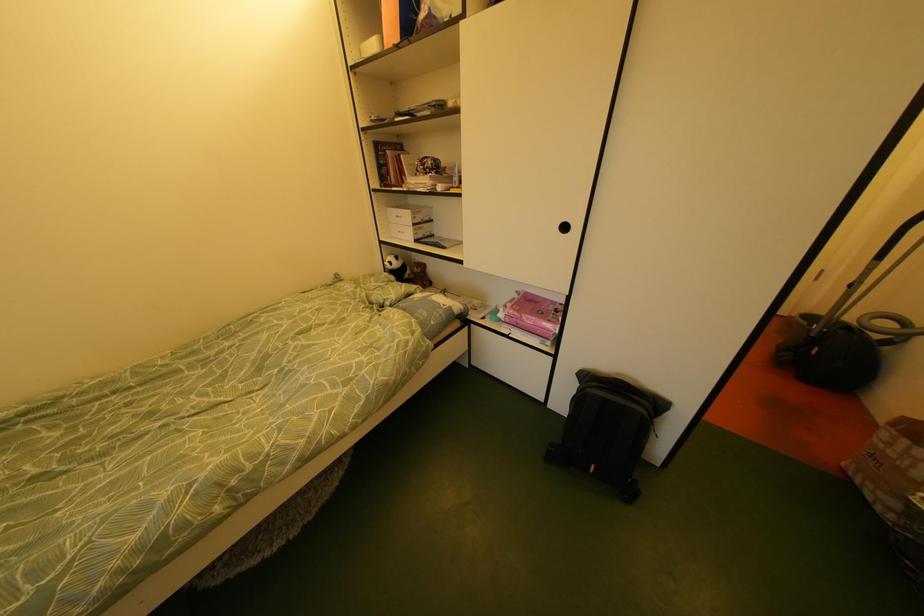
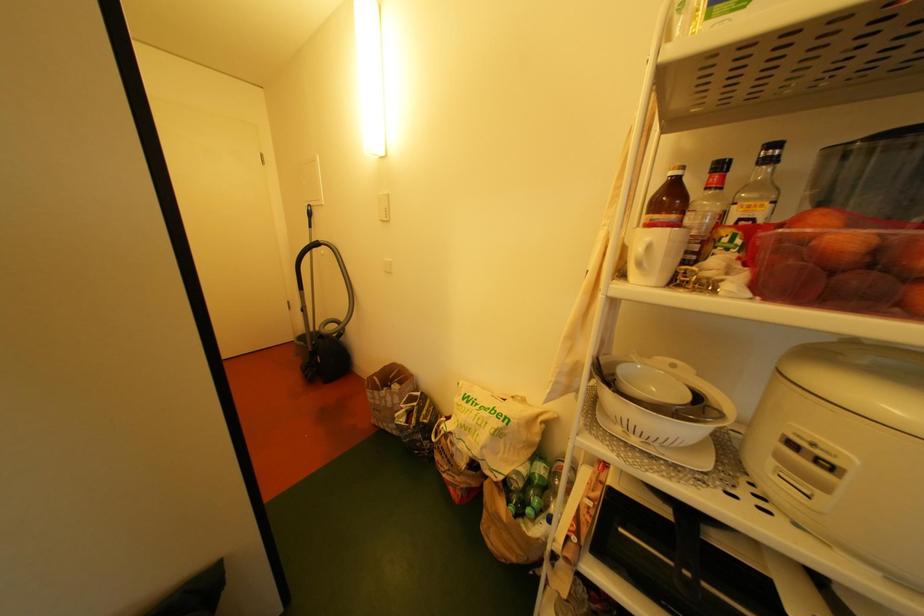
Question: The camera is either moving clockwise (left) or counter-clockwise (right) around the object. The first image is from the beginning of the video and the second image is from the end. Is the camera moving left or right when shooting the video?

Choices:
 (A) Left
 (B) Right

Answer: (A)